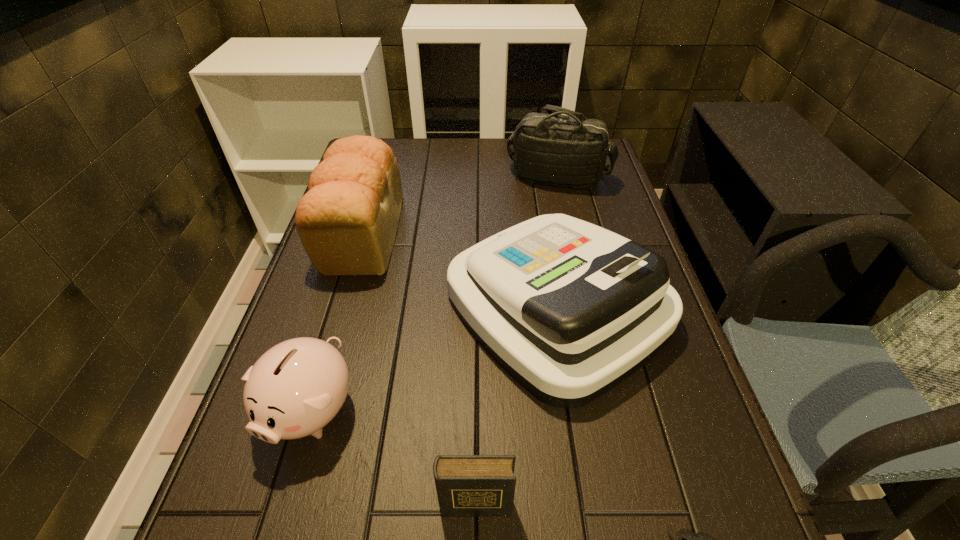
What are the coordinates of `shoulder bag` in the screenshot? It's located at (551, 149).

Where is `bread`? bread is located at coordinates (347, 222).

In order to click on cash register in this screenshot , I will do `click(568, 309)`.

This screenshot has width=960, height=540. What are the coordinates of `piggy bank` in the screenshot? It's located at (298, 386).

The image size is (960, 540). I want to click on diary, so click(x=467, y=485).

Where is `vacant space located 0.130m at the front padded panel of the shoulder bag`? The height and width of the screenshot is (540, 960). vacant space located 0.130m at the front padded panel of the shoulder bag is located at coordinates (568, 221).

Find the location of a particular element. vacant region located on the right of the bread is located at coordinates (504, 232).

Find the location of a particular element. This screenshot has width=960, height=540. vacant space located 0.110m on the left of the cash register is located at coordinates (399, 307).

Where is `free spot located 0.120m on the back of the piggy bank`? free spot located 0.120m on the back of the piggy bank is located at coordinates (338, 318).

What are the coordinates of `object located in the far edge section of the desktop` in the screenshot? It's located at (551, 149).